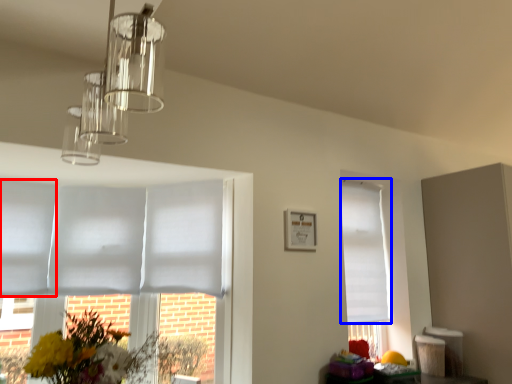
Question: Which object appears closest to the camera in this image, blind (highlighted by a red box) or blind (highlighted by a blue box)?

Choices:
 (A) blind
 (B) blind

Answer: (A)